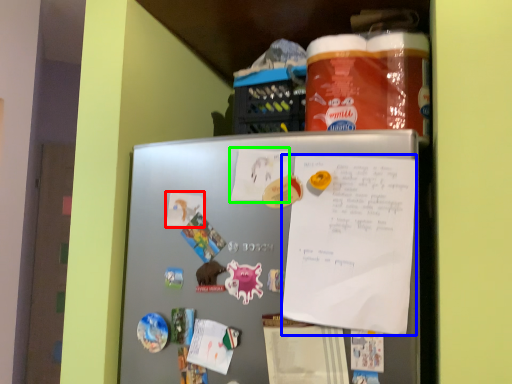
Question: Which object is the farthest from paper (highlighted by a red box)? Choose among these: poster (highlighted by a blue box) or paper (highlighted by a green box).

Choices:
 (A) poster
 (B) paper

Answer: (A)